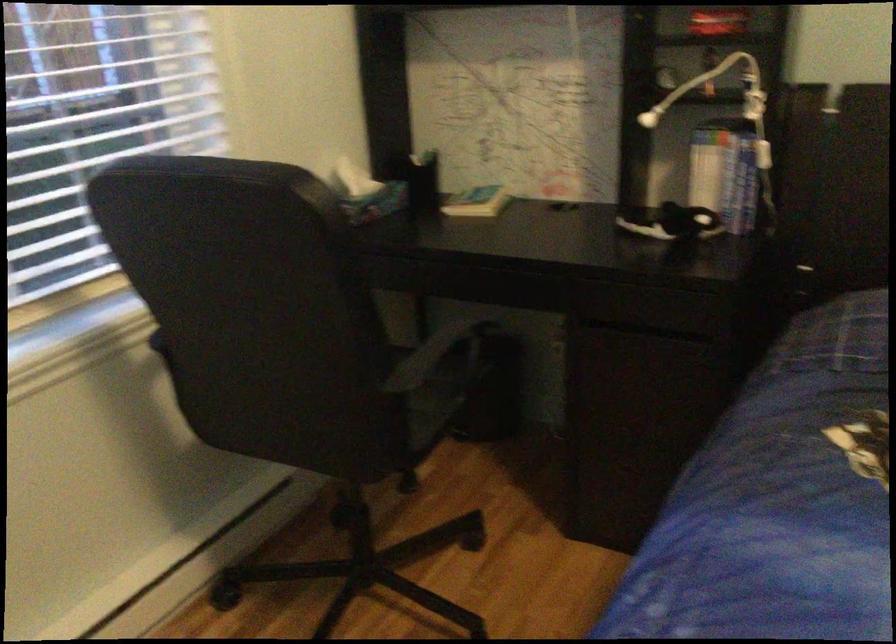
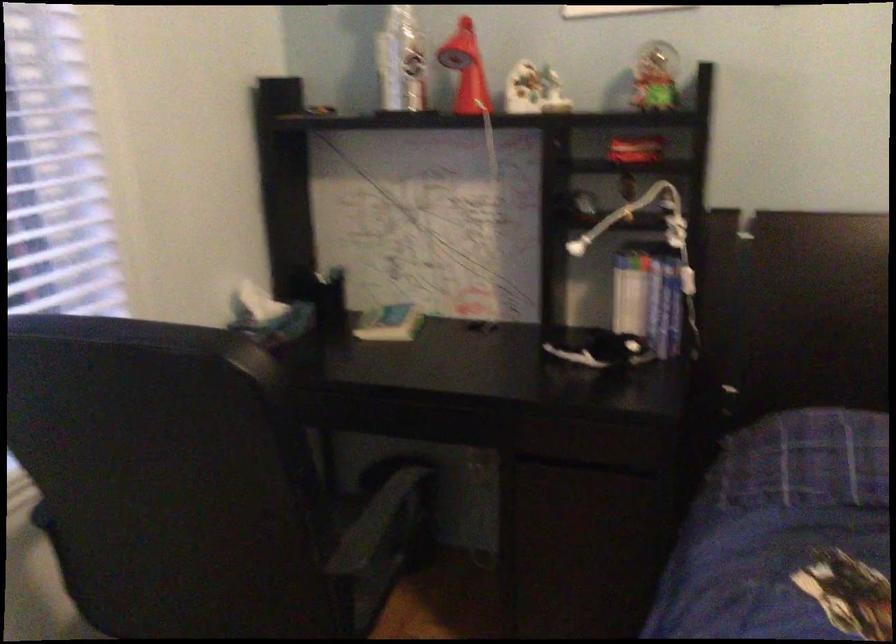
Consider the image. In a continuous first-person perspective shot, in which direction is the camera moving?

The cameraman walked toward left, forward.